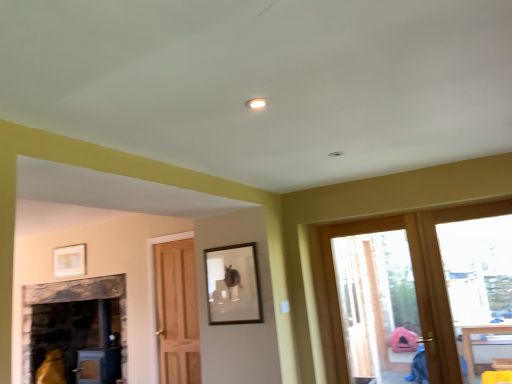
Question: From the image's perspective, is matte white picture frame at upper left, the 2th picture frame viewed from the right, located above or below matte black picture frame at center, which ranks as the 2th picture frame in left-to-right order?

Choices:
 (A) above
 (B) below

Answer: (B)

Question: Is matte white picture frame at upper left, marked as the 2th picture frame in a front-to-back arrangement, inside the boundaries of matte black picture frame at center, which appears as the 1th picture frame when viewed from the front, or outside?

Choices:
 (A) outside
 (B) inside

Answer: (A)

Question: Estimate the real-world distances between objects in this image. Which object is farther from the matte black picture frame at center, the second picture frame from the back?

Choices:
 (A) clear glass door at right, positioned as the 1th window in right-to-left order
 (B) matte white picture frame at upper left, marked as the 2th picture frame in a front-to-back arrangement
 (C) transparent glass door at right, the first window from the left

Answer: (B)

Question: Which object is positioned closest to the clear glass door at right, which is the 2th window in left-to-right order?

Choices:
 (A) transparent glass door at right, the first window from the left
 (B) matte white picture frame at upper left, the 2th picture frame viewed from the right
 (C) matte black picture frame at center, which ranks as the 2th picture frame in left-to-right order

Answer: (C)